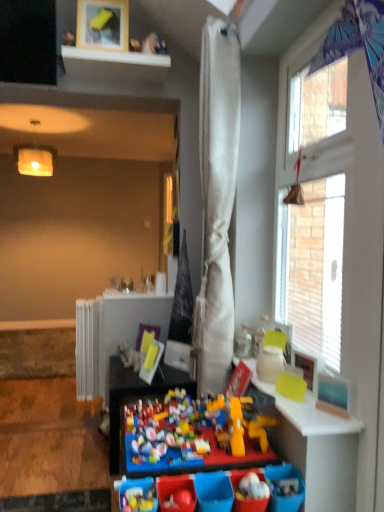
Question: Considering the positions of matte yellow table at right, which is counted as the 1th table, starting from the front, and white glossy shelf at upper center in the image, is matte yellow table at right, which is counted as the 1th table, starting from the front, taller or shorter than white glossy shelf at upper center?

Choices:
 (A) short
 (B) tall

Answer: (A)

Question: Is matte yellow table at right, which is counted as the 1th table, starting from the front, bigger or smaller than white glossy shelf at upper center?

Choices:
 (A) small
 (B) big

Answer: (A)

Question: Estimate the real-world distances between objects in this image. Which object is closer to the white textured curtain at upper right?

Choices:
 (A) white metallic radiator at left
 (B) matte yellow table at right, marked as the second table in a left-to-right arrangement
 (C) white fabric curtain at center
 (D) multicolored plastic lego at center, arranged as the 2th table when viewed from the front
 (E) brick-like plastic toy at center

Answer: (C)

Question: Which is farther from the white metallic radiator at left?

Choices:
 (A) brick-like plastic toy at center
 (B) white textured curtain at upper right
 (C) matte yellow table at right, arranged as the first table when viewed from the right
 (D) white fabric curtain at center
 (E) white glossy shelf at upper center

Answer: (B)